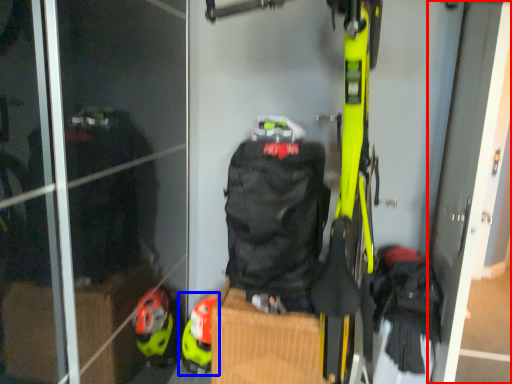
Question: Which point is further to the camera, screen door (highlighted by a red box) or footwear (highlighted by a blue box)?

Choices:
 (A) screen door
 (B) footwear

Answer: (B)